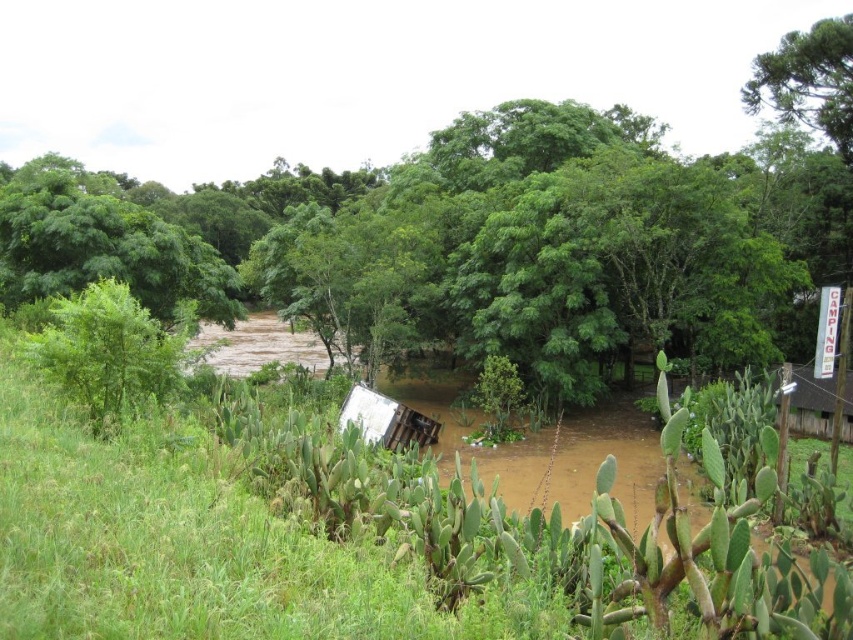
Question: Among these objects, which one is farthest from the camera?

Choices:
 (A) green leafy tree at upper right
 (B) green leafy tree at left

Answer: (A)

Question: From the image, what is the correct spatial relationship of green leafy tree at left in relation to green leafy tree at upper right?

Choices:
 (A) below
 (B) above

Answer: (A)

Question: Is green leafy tree at left further to camera compared to green leafy tree at upper right?

Choices:
 (A) no
 (B) yes

Answer: (A)

Question: Can you confirm if green leafy tree at left is positioned to the left of green leafy tree at upper right?

Choices:
 (A) yes
 (B) no

Answer: (A)

Question: Among these points, which one is farthest from the camera?

Choices:
 (A) (782, 58)
 (B) (53, 330)

Answer: (A)

Question: Which object appears closest to the camera in this image?

Choices:
 (A) green leafy tree at left
 (B) green leafy tree at upper right

Answer: (A)